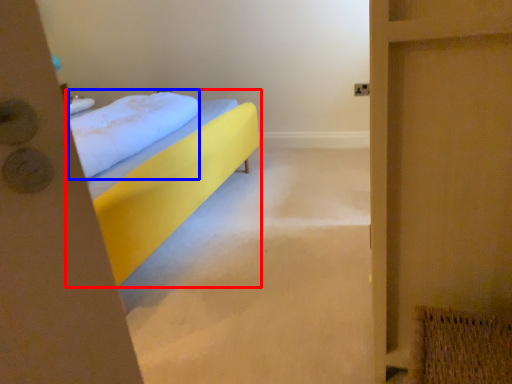
Question: Among these objects, which one is nearest to the camera, bed (highlighted by a red box) or pillow (highlighted by a blue box)?

Choices:
 (A) bed
 (B) pillow

Answer: (A)